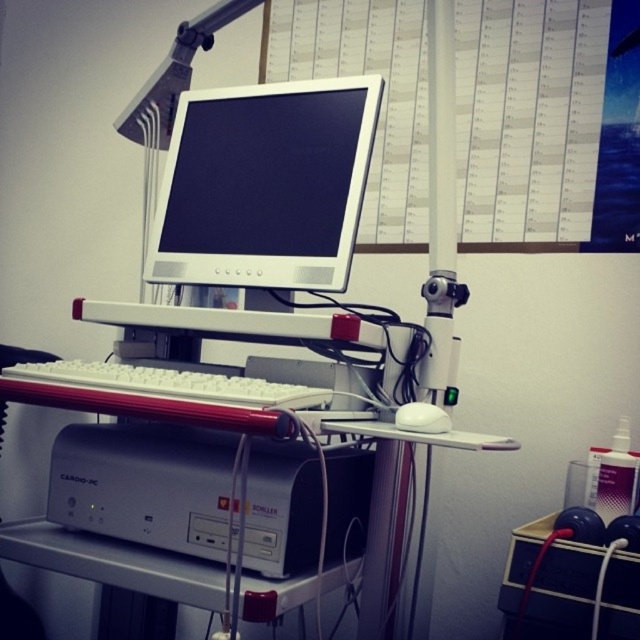
Question: Does white glossy monitor at center come in front of white matte mouse at center?

Choices:
 (A) no
 (B) yes

Answer: (A)

Question: Can you confirm if white glossy monitor at center is bigger than silver metallic printer at lower center?

Choices:
 (A) yes
 (B) no

Answer: (A)

Question: Which point appears farthest from the camera in this image?

Choices:
 (A) (115, 371)
 (B) (422, 408)
 (C) (266, 150)

Answer: (C)

Question: Which of the following is the closest to the observer?

Choices:
 (A) (228, 387)
 (B) (138, 445)

Answer: (A)

Question: Which point appears closest to the camera in this image?

Choices:
 (A) (378, 433)
 (B) (262, 394)

Answer: (B)

Question: Can you confirm if white glossy monitor at center is thinner than white plastic computer desk at center?

Choices:
 (A) no
 (B) yes

Answer: (B)